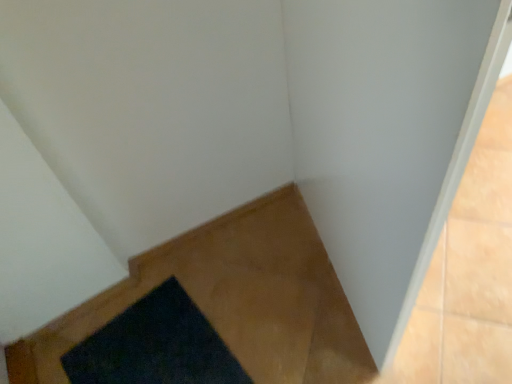
Question: Should I look upward or downward to see dark blue carpet at lower left?

Choices:
 (A) down
 (B) up

Answer: (A)